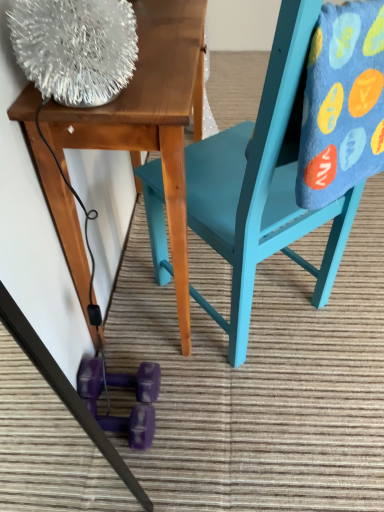
Where is `free location in front of wooden table at upper left`? The image size is (384, 512). free location in front of wooden table at upper left is located at coordinates (242, 428).